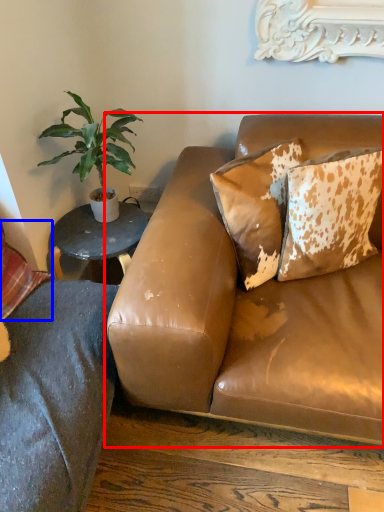
Question: Which of the following is the closest to the observer, studio couch (highlighted by a red box) or pillow (highlighted by a blue box)?

Choices:
 (A) studio couch
 (B) pillow

Answer: (A)